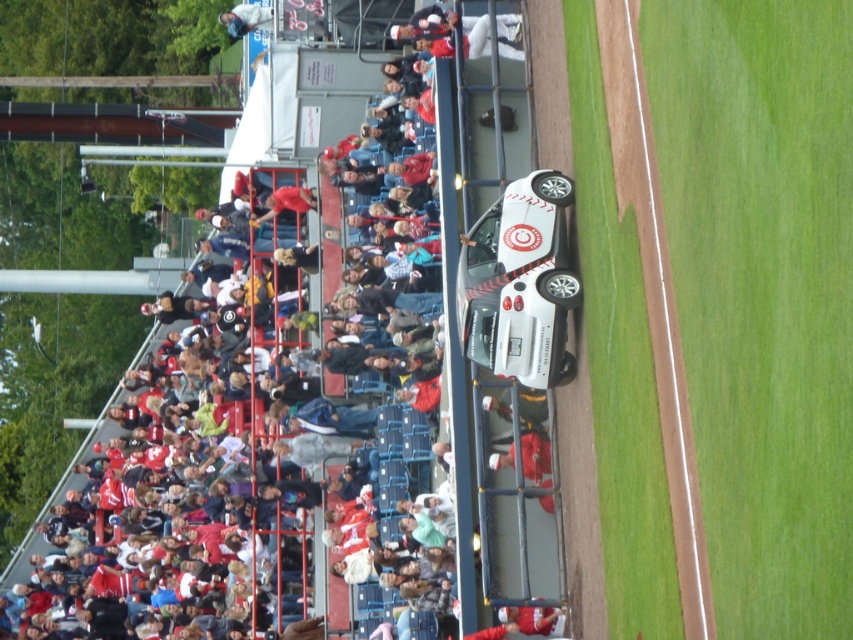
You are standing at the center of the baseball stadium field. You see a brown dirt track at center located at point (654, 298). If you walk straight ahead towards the direction of the stands, will you reach the brown dirt track at center before reaching the blue chairs?

The brown dirt track at center is located at point (654, 298), which is at the center of the field. Walking straight towards the stands would first encounter the blue chairs before reaching the center track.

You are a spectator at the baseball stadium and want to place your white plastic cup at upper center on the seat next to the white matte race car at upper center. Will the cup fit without spilling if you tilt it?

The white matte race car at upper center is much taller than the white plastic cup at upper center, so tilting the cup might not cause spilling since the car provides a stable structure nearby.